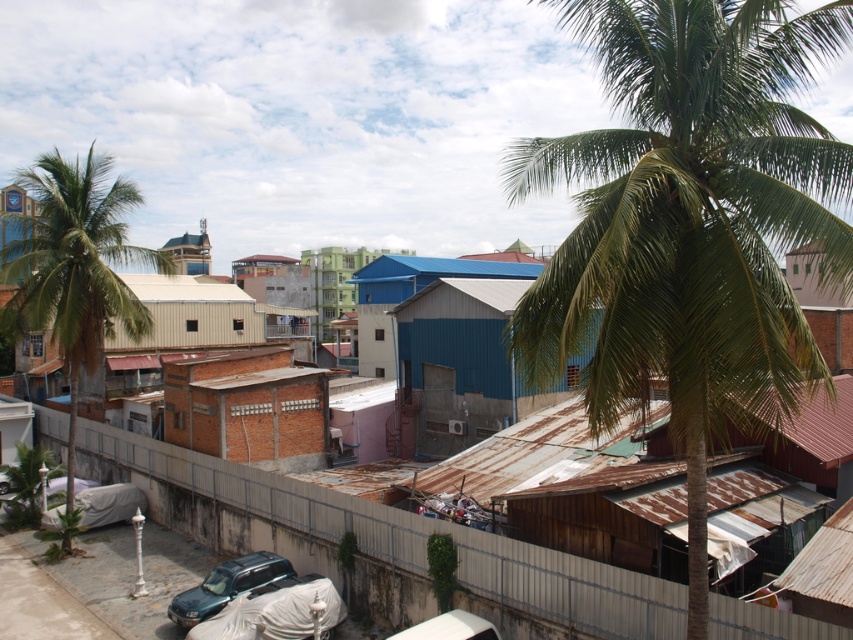
Question: Does green leafy palm tree at left appear on the right side of metallic dark green suv at lower left?

Choices:
 (A) no
 (B) yes

Answer: (A)

Question: Which of the following is the closest to the observer?

Choices:
 (A) green leafy palm tree at upper right
 (B) green leafy palm tree at left
 (C) brown brick hut at center

Answer: (A)

Question: Can you confirm if green leafy palm tree at upper right is smaller than brown brick hut at center?

Choices:
 (A) no
 (B) yes

Answer: (A)

Question: Among these points, which one is nearest to the camera?

Choices:
 (A) (97, 188)
 (B) (306, 385)
 (C) (239, 588)
 (D) (825, 33)

Answer: (D)

Question: Which of the following is the closest to the observer?

Choices:
 (A) (231, 595)
 (B) (718, 253)
 (C) (296, 387)

Answer: (B)

Question: Considering the relative positions of green leafy palm tree at left and metallic dark green suv at lower left in the image provided, where is green leafy palm tree at left located with respect to metallic dark green suv at lower left?

Choices:
 (A) left
 (B) right

Answer: (A)